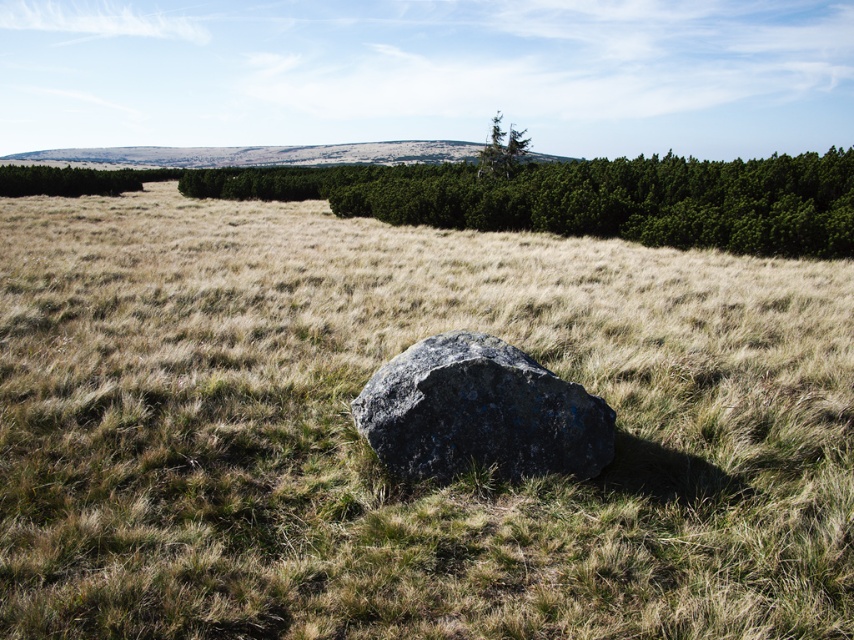
Can you confirm if brown grassy at center is positioned above green textured tree at upper center?

Actually, brown grassy at center is below green textured tree at upper center.

Who is positioned more to the left, brown grassy at center or green textured tree at upper center?

Positioned to the left is brown grassy at center.

Who is more forward, [639,426] or [496,156]?

Point [639,426] is in front.

Locate an element on the screen. The image size is (854, 640). brown grassy at center is located at coordinates point(375,456).

Is point (223, 305) positioned in front of point (547, 184)?

Yes.

Consider the image. Between brown grassy at center and green textured trees at upper center, which one is positioned lower?

brown grassy at center is lower down.

Locate an element on the screen. Image resolution: width=854 pixels, height=640 pixels. brown grassy at center is located at coordinates (375, 456).

Find the location of `brown grassy at center`. brown grassy at center is located at coordinates pos(375,456).

Is green textured trees at upper center positioned in front of green textured tree at upper center?

Yes, green textured trees at upper center is closer to the viewer.

Can you confirm if green textured trees at upper center is thinner than green textured tree at upper center?

In fact, green textured trees at upper center might be wider than green textured tree at upper center.

Which is in front, point (828, 232) or point (495, 124)?

Point (828, 232) is more forward.

The height and width of the screenshot is (640, 854). I want to click on green textured trees at upper center, so click(x=588, y=198).